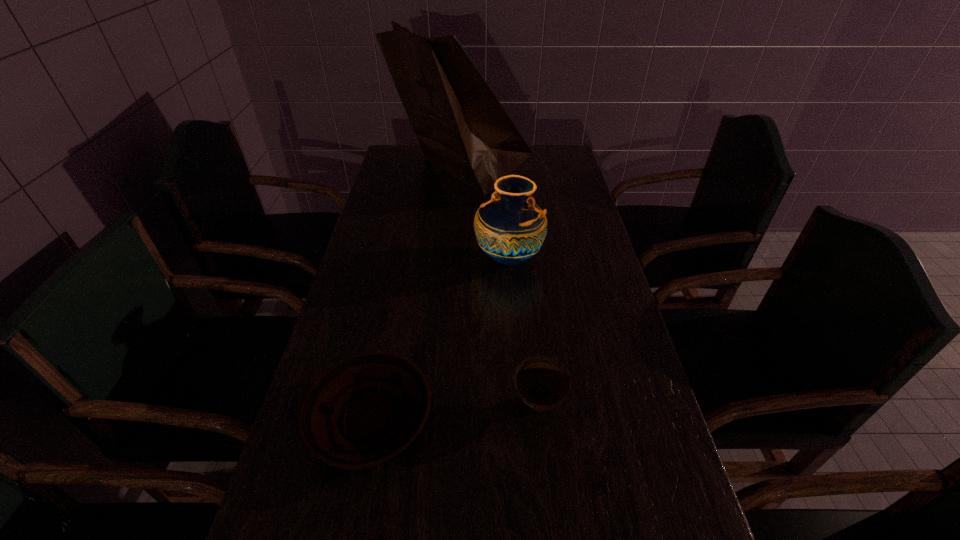
Find the location of a particular element. grocery bag is located at coordinates (461, 126).

At what (x,y) coordinates should I click in order to perform the action: click on the farthest object. Please return your answer as a coordinate pair (x, y). The width and height of the screenshot is (960, 540). Looking at the image, I should click on (461, 126).

Image resolution: width=960 pixels, height=540 pixels. I want to click on the third shortest object, so click(510, 228).

Find the location of `pottery`. pottery is located at coordinates (510, 228).

Find the location of a particular element. The image size is (960, 540). the second shortest object is located at coordinates (542, 382).

Where is `the shortest object`? the shortest object is located at coordinates (366, 409).

Image resolution: width=960 pixels, height=540 pixels. Identify the location of free space located on the right of the tallest object. (568, 174).

Image resolution: width=960 pixels, height=540 pixels. What are the coordinates of `vacant space positioned on the left of the pottery` in the screenshot? It's located at (433, 258).

At what (x,y) coordinates should I click in order to perform the action: click on vacant space situated on the right of the second shortest object. Please return your answer as a coordinate pair (x, y). Image resolution: width=960 pixels, height=540 pixels. Looking at the image, I should click on (610, 405).

The width and height of the screenshot is (960, 540). I want to click on vacant space situated 0.300m on the right of the shortest object, so click(x=579, y=419).